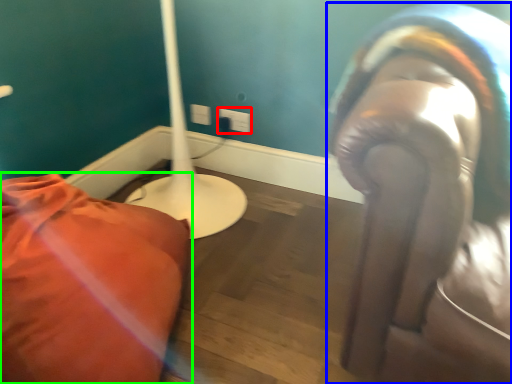
Question: Based on their relative distances, which object is nearer to electric outlet (highlighted by a red box)? Choose from person (highlighted by a blue box) and furniture (highlighted by a green box).

Choices:
 (A) person
 (B) furniture

Answer: (B)